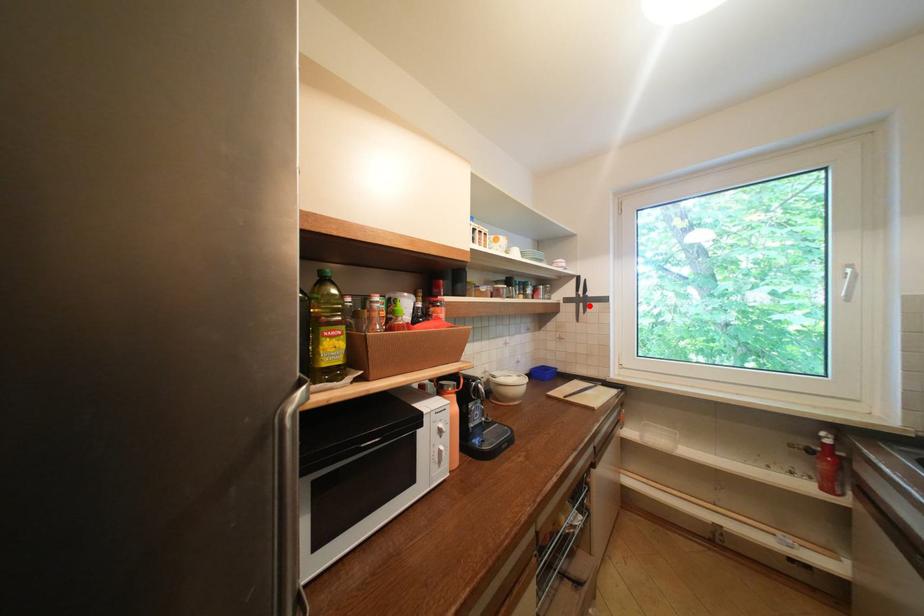
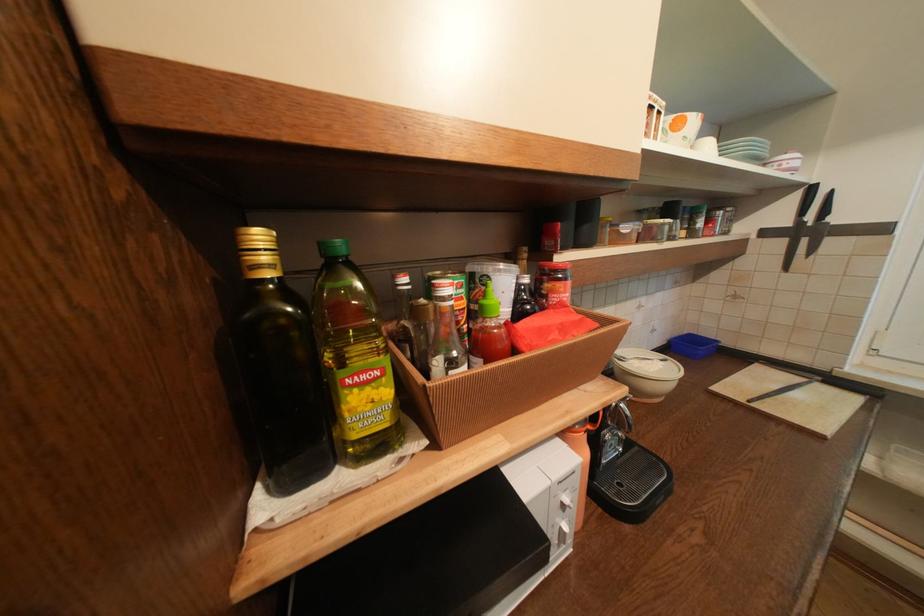
In the second image, find the point that corresponds to the highlighted location in the first image.

(812, 241)